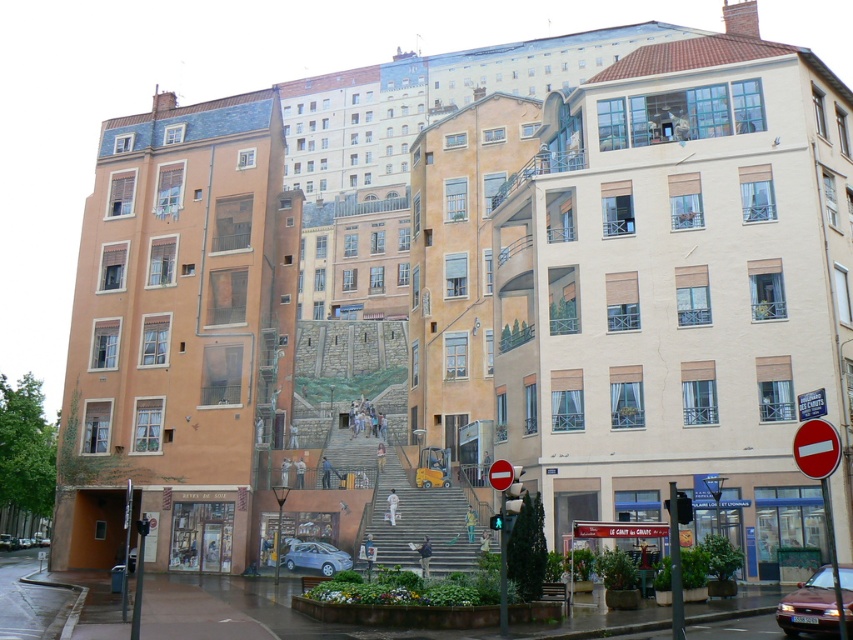
Does point (796, 454) lie behind point (299, 566)?

No, (796, 454) is in front of (299, 566).

Who is positioned more to the right, red plastic sign at right or silver metallic hatchback at center?

red plastic sign at right

Who is more distant from viewer, (813, 449) or (302, 561)?

The point (302, 561) is behind.

Locate an element on the screen. red plastic sign at right is located at coordinates (816, 449).

Between point (393, 476) and point (833, 614), which one is positioned in front?

Positioned in front is point (833, 614).

Is yellow plastic stairs at center smaller than metallic red car at lower right?

Actually, yellow plastic stairs at center might be larger than metallic red car at lower right.

Where is `yellow plastic stairs at center`? The image size is (853, 640). yellow plastic stairs at center is located at coordinates (422, 522).

Who is shorter, metallic red car at lower right or red plastic sign at right?

Standing shorter between the two is red plastic sign at right.

Is point (846, 621) behind point (805, 444)?

No.

This screenshot has height=640, width=853. What are the coordinates of `metallic red car at lower right` in the screenshot? It's located at (809, 605).